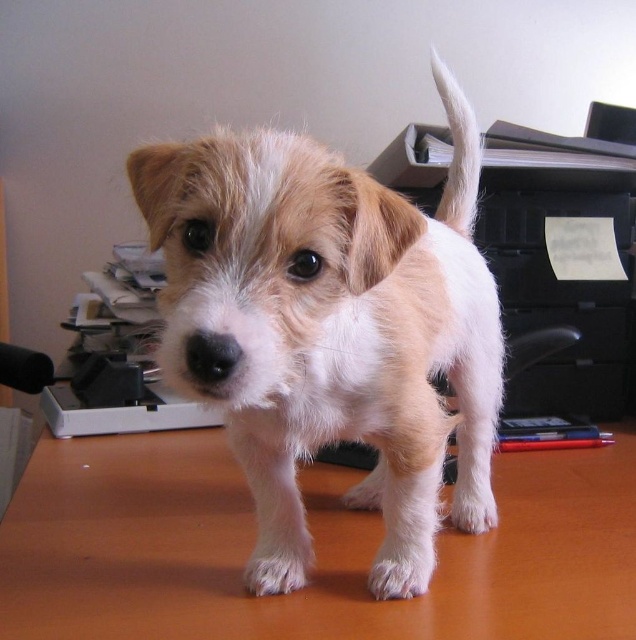
Question: Which is farther from the white fluffy tail at upper right?

Choices:
 (A) brown wooden desk at center
 (B) fuzzy white dog at center

Answer: (A)

Question: Which point appears closest to the camera in this image?

Choices:
 (A) (190, 273)
 (B) (477, 148)

Answer: (A)

Question: Which point is farther to the camera?

Choices:
 (A) (342, 182)
 (B) (522, 592)
 (C) (457, 180)

Answer: (C)

Question: Is brown wooden desk at center above white fluffy tail at upper right?

Choices:
 (A) no
 (B) yes

Answer: (A)

Question: Does fuzzy white dog at center have a greater width compared to white fluffy tail at upper right?

Choices:
 (A) yes
 (B) no

Answer: (A)

Question: Does fuzzy white dog at center appear on the right side of brown wooden desk at center?

Choices:
 (A) no
 (B) yes

Answer: (B)